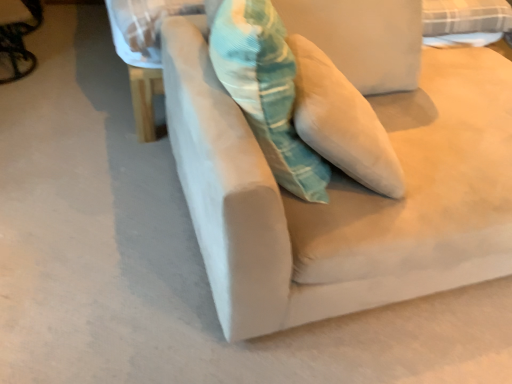
Identify the location of suede beige couch at center. (344, 194).

In order to face textured teal pillow at center, should I rotate leftwards or rightwards?

It's best to rotate right around 1.136 degrees.

Find the location of a particular element. metallic silver swivel chair at left is located at coordinates (17, 37).

Is textured teal pillow at center inside or outside of metallic silver swivel chair at left?

textured teal pillow at center is not enclosed by metallic silver swivel chair at left.

In order to click on swivel chair to the left of textured teal pillow at center in this screenshot , I will do `click(17, 37)`.

Is point (326, 180) behind point (32, 19)?

No.

Is textured teal pillow at center positioned with its back to metallic silver swivel chair at left?

No, metallic silver swivel chair at left is not at the back of textured teal pillow at center.

How different are the orientations of metallic silver swivel chair at left and suede beige couch at center in degrees?

17.4 degrees.

In the image, there is a suede beige couch at center. Identify the location of swivel chair above it (from the image's perspective). (17, 37).

In terms of height, does metallic silver swivel chair at left look taller or shorter compared to suede beige couch at center?

Considering their sizes, metallic silver swivel chair at left has less height than suede beige couch at center.

Could suede beige couch at center be considered to be inside metallic silver swivel chair at left?

Definitely not — suede beige couch at center is not inside metallic silver swivel chair at left.

From the picture: Does metallic silver swivel chair at left have a lesser height compared to textured teal pillow at center?

Yes.

Which of these two, metallic silver swivel chair at left or textured teal pillow at center, is wider?

metallic silver swivel chair at left.

From a real-world perspective, is suede beige couch at center on metallic silver swivel chair at left?

Indeed, from a real-world perspective, suede beige couch at center stands above metallic silver swivel chair at left.

Based on the photo, which of these two, suede beige couch at center or metallic silver swivel chair at left, is smaller?

metallic silver swivel chair at left is smaller.

From the picture: From the image's perspective, is suede beige couch at center under metallic silver swivel chair at left?

Yes, from the image's perspective, suede beige couch at center is beneath metallic silver swivel chair at left.

Based on the photo, from a real-world perspective, is textured teal pillow at center on top of suede beige couch at center?

Yes, from a real-world perspective, textured teal pillow at center is on top of suede beige couch at center.

Between textured teal pillow at center and suede beige couch at center, which one appears on the left side from the viewer's perspective?

textured teal pillow at center.

From the image's perspective, between textured teal pillow at center and suede beige couch at center, who is located below?

From the image's view, suede beige couch at center is below.

Considering the sizes of textured teal pillow at center and suede beige couch at center in the image, is textured teal pillow at center wider or thinner than suede beige couch at center?

Considering their sizes, textured teal pillow at center looks slimmer than suede beige couch at center.

Is suede beige couch at center far away from textured teal pillow at center?

Actually, suede beige couch at center and textured teal pillow at center are a little close together.

Based on their sizes in the image, would you say suede beige couch at center is bigger or smaller than textured teal pillow at center?

Considering their sizes, suede beige couch at center takes up more space than textured teal pillow at center.

Does suede beige couch at center have a lesser width compared to textured teal pillow at center?

No.

Is suede beige couch at center turned away from textured teal pillow at center?

That's not correct — suede beige couch at center is not looking away from textured teal pillow at center.

This screenshot has width=512, height=384. What are the coordinates of `swivel chair on the left of textured teal pillow at center` in the screenshot? It's located at (17, 37).

The image size is (512, 384). I want to click on studio couch in front of the metallic silver swivel chair at left, so click(344, 194).

Which object lies nearer to the anchor point textured teal pillow at center, suede beige couch at center or metallic silver swivel chair at left?

The object closer to textured teal pillow at center is suede beige couch at center.

When comparing their distances from suede beige couch at center, does metallic silver swivel chair at left or textured teal pillow at center seem closer?

The object closer to suede beige couch at center is textured teal pillow at center.

Considering their positions, is textured teal pillow at center positioned further to metallic silver swivel chair at left than suede beige couch at center?

suede beige couch at center.

Which object lies nearer to the anchor point metallic silver swivel chair at left, suede beige couch at center or textured teal pillow at center?

Based on the image, textured teal pillow at center appears to be nearer to metallic silver swivel chair at left.

Considering their positions, is textured teal pillow at center positioned closer to suede beige couch at center than metallic silver swivel chair at left?

textured teal pillow at center lies closer to suede beige couch at center than the other object.

When comparing their distances from textured teal pillow at center, does metallic silver swivel chair at left or suede beige couch at center seem further?

metallic silver swivel chair at left is further to textured teal pillow at center.

Locate an element on the screen. throw pillow between metallic silver swivel chair at left and suede beige couch at center from left to right is located at coordinates (266, 91).